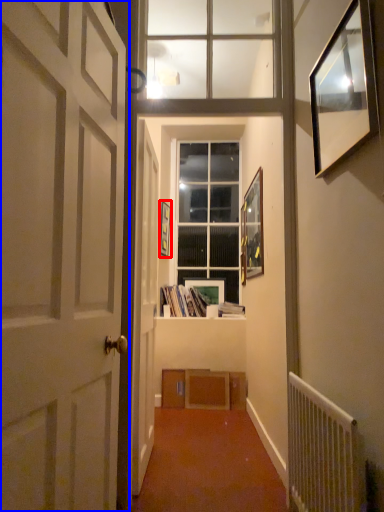
Question: Which of the following is the farthest to the observer, picture frame (highlighted by a red box) or door (highlighted by a blue box)?

Choices:
 (A) picture frame
 (B) door

Answer: (A)